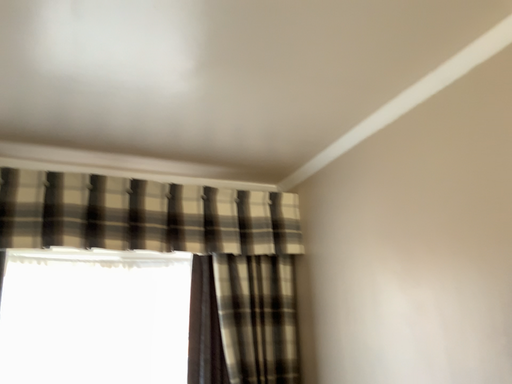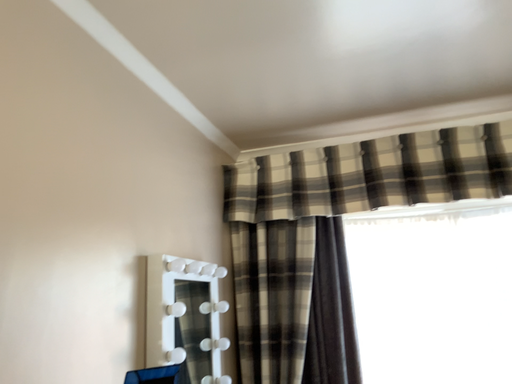
Question: How did the camera likely rotate when shooting the video?

Choices:
 (A) rotated downward
 (B) rotated upward

Answer: (A)